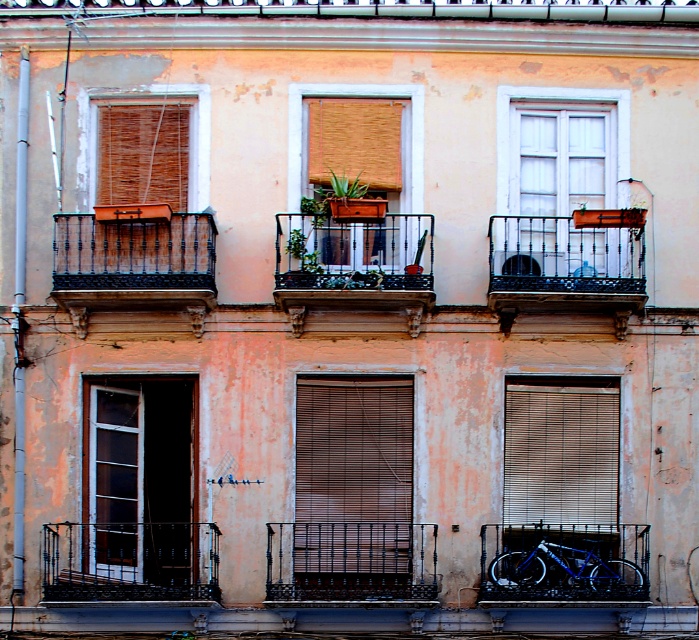
Is wooden blinds at lower right taller than blue metallic bicycle at lower right?

Yes.

Does point (603, 408) come in front of point (545, 524)?

No, it is not.

You are a GUI agent. You are given a task and a screenshot of the screen. Output one action in this format:
    pyautogui.click(x=<x>, y=<y>)
    Task: Click on the wooden blinds at lower right
    This screenshot has height=640, width=699.
    Given the screenshot: What is the action you would take?
    pyautogui.click(x=561, y=451)

This screenshot has height=640, width=699. What do you see at coordinates (140, 483) in the screenshot?
I see `matte glass door at left` at bounding box center [140, 483].

Is matte glass door at left above white wood window at upper center?

Incorrect, matte glass door at left is not positioned above white wood window at upper center.

Locate an element on the screen. Image resolution: width=699 pixels, height=640 pixels. matte glass door at left is located at coordinates (140, 483).

This screenshot has height=640, width=699. In order to click on matte glass door at left in this screenshot , I will do `click(140, 483)`.

Does rustic wrought iron balcony at center appear over white wood window at upper center?

No, rustic wrought iron balcony at center is not above white wood window at upper center.

In the scene shown: Between rustic wrought iron balcony at center and white wood window at upper center, which one has more height?

white wood window at upper center

Does point (569, 294) lie behind point (591, 97)?

No, (569, 294) is closer to viewer.

In order to click on rustic wrought iron balcony at center in this screenshot , I will do `click(565, 264)`.